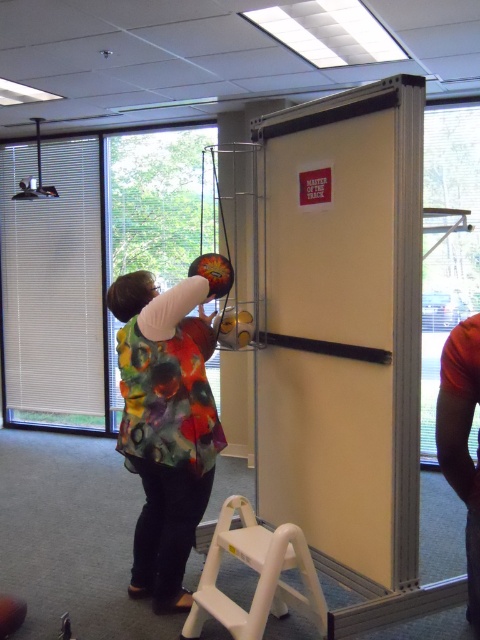
Is point (415, 406) in front of point (80, 385)?

Yes, point (415, 406) is in front of point (80, 385).

Between white matte screen door at center and matte white glass door at left, which one appears on the right side from the viewer's perspective?

white matte screen door at center

Does point (292, 193) come farther from viewer compared to point (60, 228)?

No.

Identify the location of white matte screen door at center. (345, 324).

Can you confirm if transparent glass door at center is positioned above white plastic stool at lower center?

Yes, transparent glass door at center is above white plastic stool at lower center.

At what (x,y) coordinates should I click in order to perform the action: click on transparent glass door at center. Please return your answer as a coordinate pair (x, y). Looking at the image, I should click on (154, 202).

Does matte white glass door at left come in front of white plastic stool at lower center?

No, it is not.

Is matte white glass door at left to the right of white plastic stool at lower center from the viewer's perspective?

Incorrect, matte white glass door at left is not on the right side of white plastic stool at lower center.

Measure the distance between point (0, 248) and camera.

Point (0, 248) and camera are 5.96 meters apart from each other.

Locate an element on the screen. matte white glass door at left is located at coordinates (52, 288).